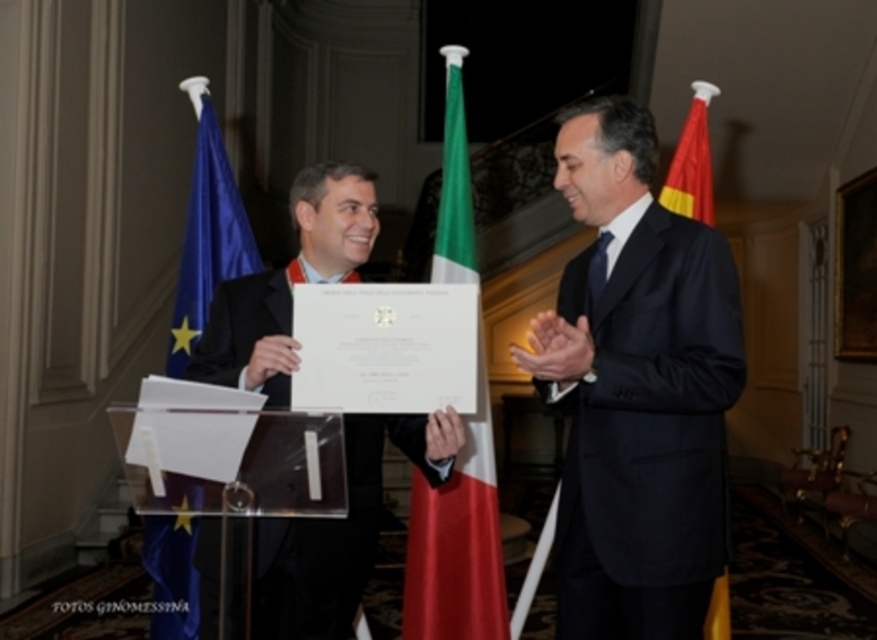
Consider the image. You are standing in the room and see two points marked in the image. Which point, point [403,428] or point [223,244], is closer to you?

Point [403,428] is closer to the camera than point [223,244], so it is closer to you.

You are a photographer at a formal event. You need to capture a clear shot of the matte black suit at center and the green fabric flag at center. Based on their positions, which one is covering part of the other?

The matte black suit at center is positioned over green fabric flag at center, so it is covering part of the green fabric flag at center.